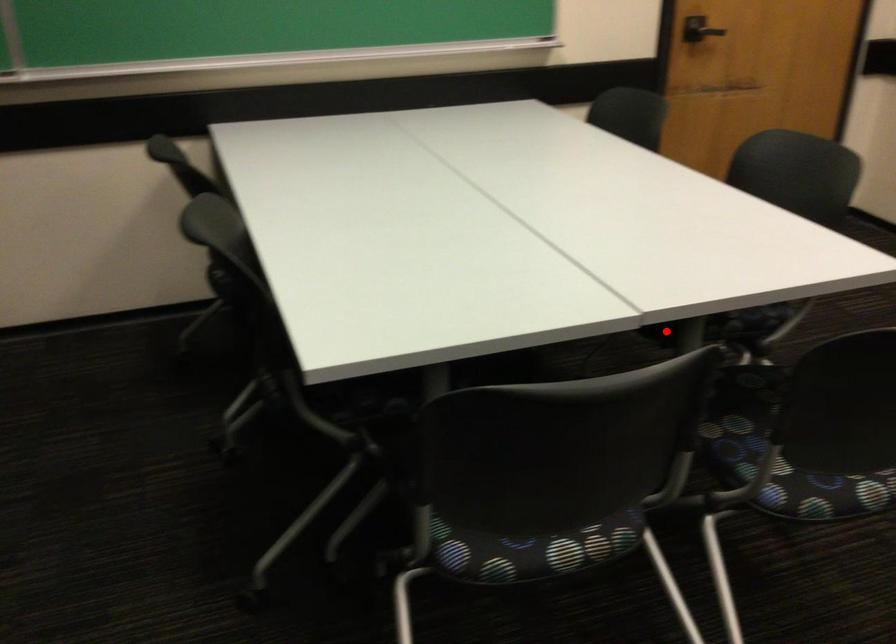
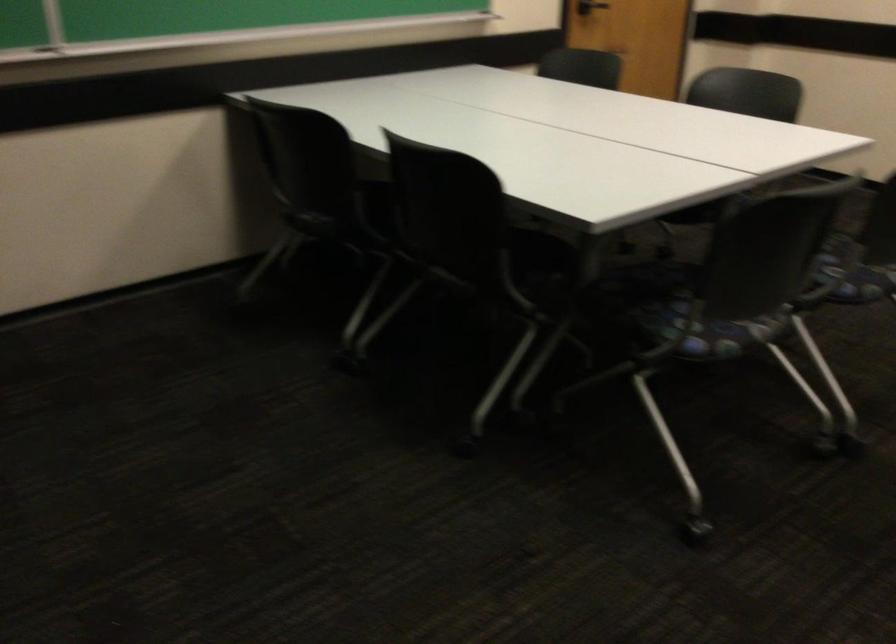
In the second image, find the point that corresponds to the highlighted location in the first image.

(703, 214)